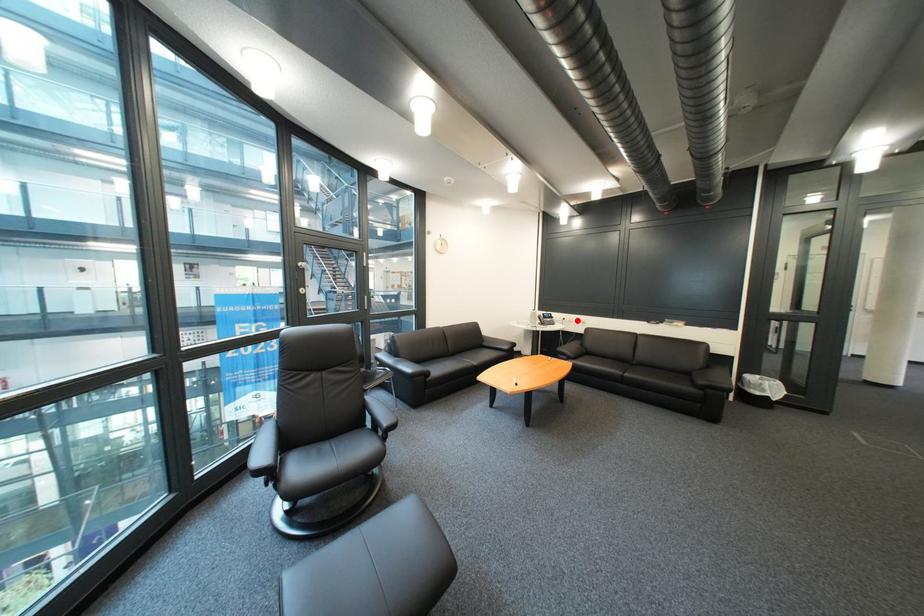
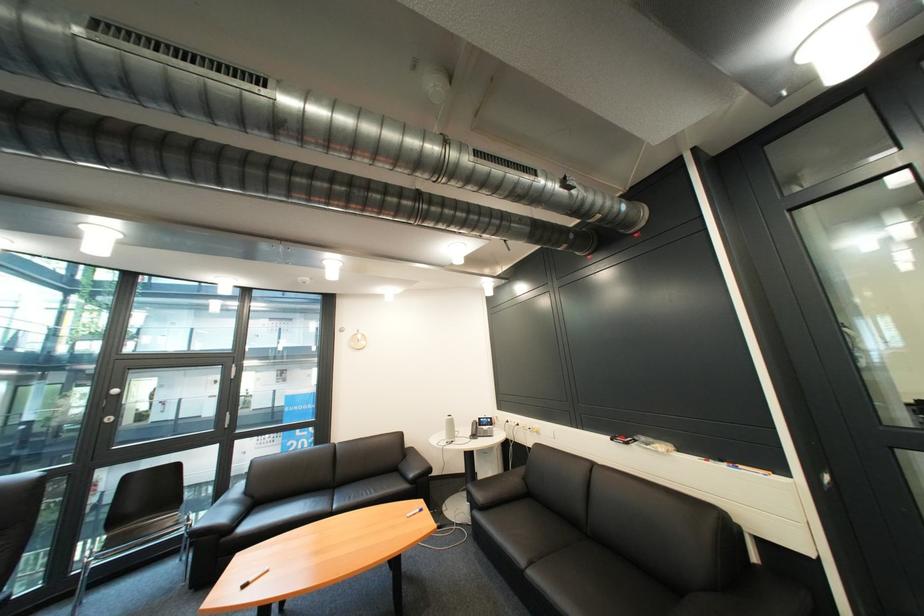
Find the pixel in the second image that matches the highlighted location in the first image.

(531, 426)